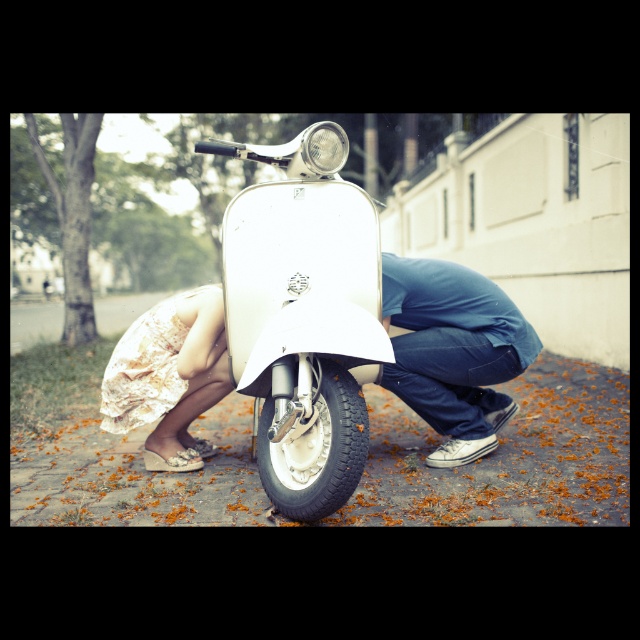
Consider the image. Which is below, white glossy scooter at center or blue denim jeans at lower center?

blue denim jeans at lower center

How much distance is there between white glossy scooter at center and blue denim jeans at lower center?

white glossy scooter at center and blue denim jeans at lower center are 31.60 inches apart.

Does point (280, 292) come farther from viewer compared to point (442, 432)?

That is False.

Locate an element on the screen. white glossy scooter at center is located at coordinates (304, 316).

Does point (308, 291) lie in front of point (154, 326)?

Yes, it is.

Does white glossy scooter at center appear over white floral dress at lower left?

Yes.

Locate an element on the screen. white glossy scooter at center is located at coordinates (304, 316).

Locate an element on the screen. The width and height of the screenshot is (640, 640). white glossy scooter at center is located at coordinates (304, 316).

Is blue denim jeans at lower center to the left of white floral dress at lower left from the viewer's perspective?

Incorrect, blue denim jeans at lower center is not on the left side of white floral dress at lower left.

Between point (438, 324) and point (150, 412), which one is positioned in front?

Point (438, 324)

Where is `blue denim jeans at lower center`? The width and height of the screenshot is (640, 640). blue denim jeans at lower center is located at coordinates (452, 352).